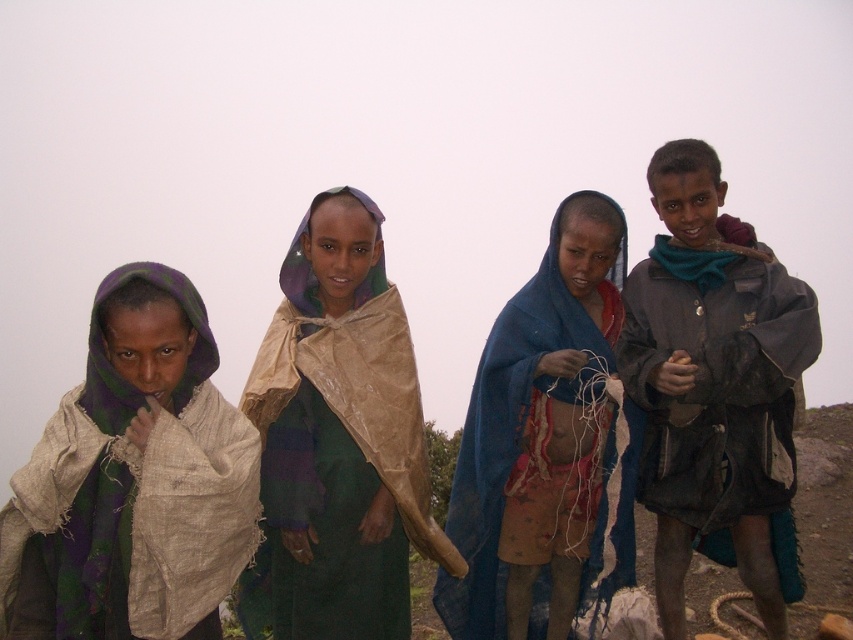
From the picture: Can you confirm if green fabric wrapped at center is thinner than dark gray jacket at right?

Incorrect, green fabric wrapped at center's width is not less than dark gray jacket at right's.

Which is more to the left, green fabric wrapped at center or dark gray jacket at right?

From the viewer's perspective, green fabric wrapped at center appears more on the left side.

Is point (397, 392) farther from viewer compared to point (701, 196)?

No, (397, 392) is closer to viewer.

Where is `green fabric wrapped at center`? green fabric wrapped at center is located at coordinates (337, 440).

Describe the element at coordinates (715, 388) in the screenshot. I see `dark gray jacket at right` at that location.

Can you confirm if dark gray jacket at right is positioned to the left of blue sheer cloth at center?

In fact, dark gray jacket at right is to the right of blue sheer cloth at center.

Looking at this image, who is more forward, (712, 449) or (602, 253)?

Point (712, 449)

Where is `dark gray jacket at right`? This screenshot has height=640, width=853. dark gray jacket at right is located at coordinates (715, 388).

Does blue sheer cloth at center have a larger size compared to beige fabric scarf at left?

Indeed, blue sheer cloth at center has a larger size compared to beige fabric scarf at left.

Looking at this image, is blue sheer cloth at center to the left of beige fabric scarf at left from the viewer's perspective?

In fact, blue sheer cloth at center is to the right of beige fabric scarf at left.

At what (x,y) coordinates should I click in order to perform the action: click on blue sheer cloth at center. Please return your answer as a coordinate pair (x, y). Looking at the image, I should click on (547, 445).

Identify the location of blue sheer cloth at center. (547, 445).